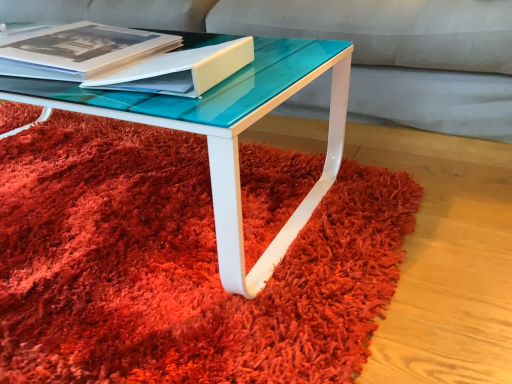
Question: Considering the relative positions of shaggy red carpet at center and matte black book at upper left in the image provided, is shaggy red carpet at center to the right of matte black book at upper left from the viewer's perspective?

Choices:
 (A) no
 (B) yes

Answer: (A)

Question: From a real-world perspective, is shaggy red carpet at center beneath matte black book at upper left?

Choices:
 (A) no
 (B) yes

Answer: (B)

Question: Does shaggy red carpet at center turn towards matte black book at upper left?

Choices:
 (A) yes
 (B) no

Answer: (B)

Question: Is the position of shaggy red carpet at center more distant than that of matte black book at upper left?

Choices:
 (A) no
 (B) yes

Answer: (A)

Question: Would you say shaggy red carpet at center is a long distance from matte black book at upper left?

Choices:
 (A) no
 (B) yes

Answer: (A)

Question: Does point (225, 59) appear closer or farther from the camera than point (145, 324)?

Choices:
 (A) farther
 (B) closer

Answer: (A)

Question: In terms of height, does matte white book at center look taller or shorter compared to shaggy red carpet at center?

Choices:
 (A) tall
 (B) short

Answer: (A)

Question: Is matte white book at center wider or thinner than shaggy red carpet at center?

Choices:
 (A) thin
 (B) wide

Answer: (A)

Question: Is matte white book at center inside or outside of shaggy red carpet at center?

Choices:
 (A) outside
 (B) inside

Answer: (A)

Question: From the image's perspective, is matte black book at upper left located above or below shaggy red carpet at center?

Choices:
 (A) below
 (B) above

Answer: (B)

Question: Relative to shaggy red carpet at center, is matte black book at upper left in front or behind?

Choices:
 (A) behind
 (B) front

Answer: (A)

Question: Considering the positions of matte black book at upper left and shaggy red carpet at center in the image, is matte black book at upper left wider or thinner than shaggy red carpet at center?

Choices:
 (A) thin
 (B) wide

Answer: (A)

Question: From a real-world perspective, is matte black book at upper left physically located above or below shaggy red carpet at center?

Choices:
 (A) above
 (B) below

Answer: (A)

Question: Choose the correct answer: Is shaggy red carpet at center inside matte white book at center or outside it?

Choices:
 (A) inside
 (B) outside

Answer: (B)

Question: Visually, is shaggy red carpet at center positioned to the left or to the right of matte white book at center?

Choices:
 (A) right
 (B) left

Answer: (B)